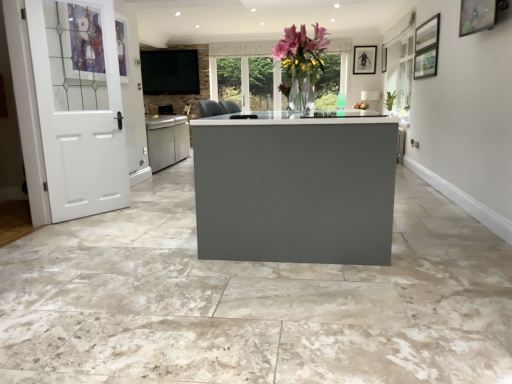
At what (x,y) coordinates should I click in order to perform the action: click on vacant space in white painted wood door at left (from a real-world perspective). Please return your answer as a coordinate pair (x, y). Image resolution: width=512 pixels, height=384 pixels. Looking at the image, I should click on (90, 216).